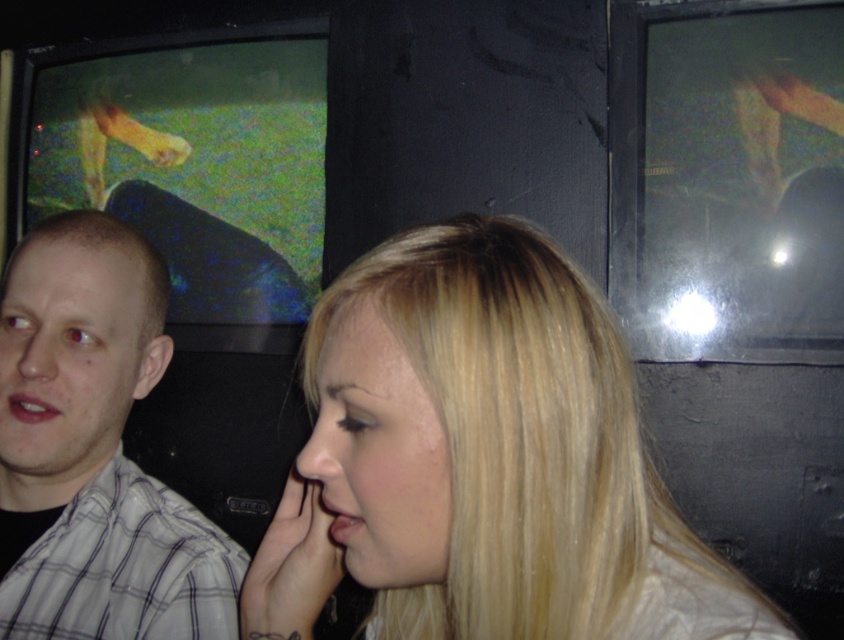
Identify the location of blonde hair at center. The image size is (844, 640). (479, 458).